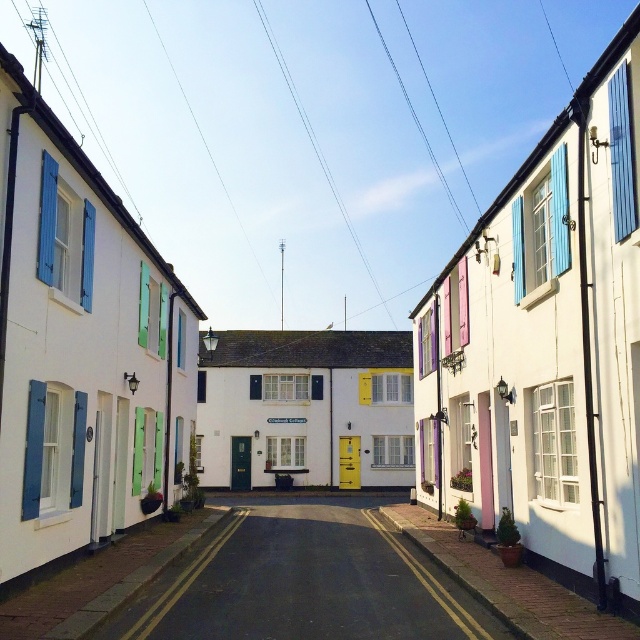
You are standing on the sidewalk and want to cross the street to reach the white matte house at center. Which direction should you look before stepping onto the smooth asphalt road at center?

The smooth asphalt road at center is located below the white matte house at center, so you should look downward towards the smooth asphalt road at center before stepping onto it to reach the white matte house at center.

You are a delivery person with a cart that can move up to 30 feet per minute. You need to deliver a package to the white matte house at center from the terracotta pot at lower right. How many minutes will it take you to reach the house?

The white matte house at center is 50.90 feet from the terracotta pot at lower right. Since the cart moves at 30 feet per minute, it will take approximately 1.7 minutes to reach the house.